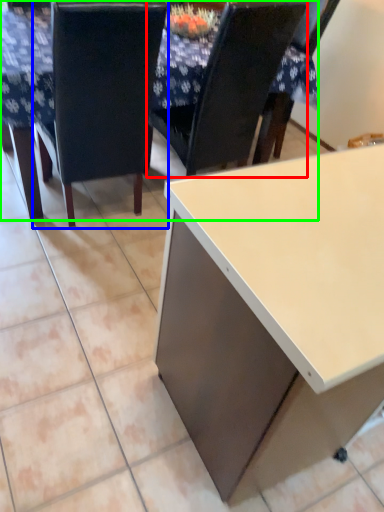
Question: Which object is the farthest from chair (highlighted by a red box)? Choose among these: chair (highlighted by a blue box) or table (highlighted by a green box).

Choices:
 (A) chair
 (B) table

Answer: (B)